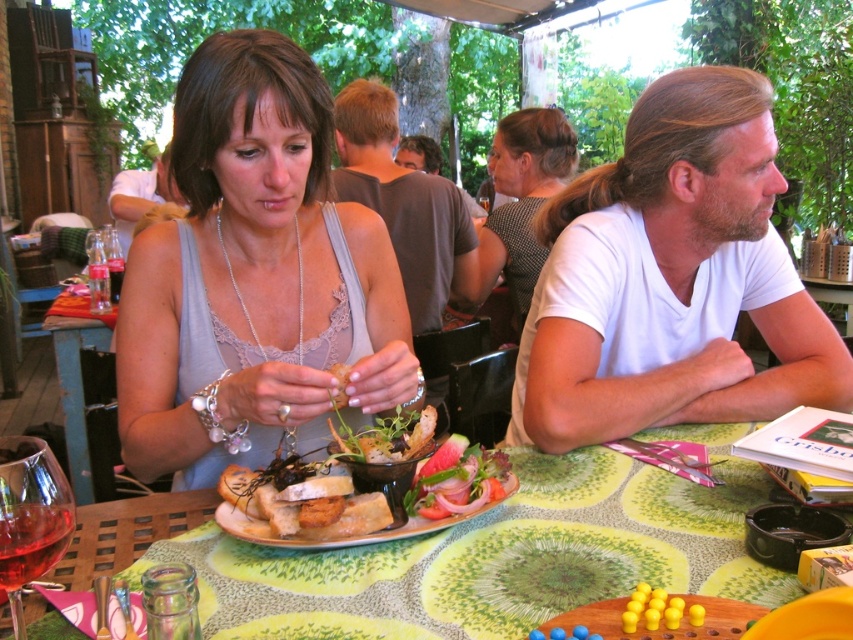
You are a photographer trying to capture a closeup of the transparent glass wine at lower left without the white cotton shirt at upper right appearing in the shot. Can you adjust your position to do this?

The white cotton shirt at upper right is further to the viewer than transparent glass wine at lower left, so moving your camera position slightly forward or to the side might allow you to frame the shot so the transparent glass wine at lower left is visible without the white cotton shirt at upper right blocking it.

In the scene shown: You are a server at the restaurant and need to determine if the white cotton shirt at upper right can be folded and placed into the transparent glass wine at lower left. Based on their sizes, is this possible?

The white cotton shirt at upper right has a larger size compared to the transparent glass wine at lower left, so it cannot be folded and placed inside.

You are a photographer standing at the camera position. You want to take a closeup shot of the gray cotton shirt at center. Considering the distance between you and the shirt, is it possible to capture the shirt clearly without moving closer?

The gray cotton shirt at center is 7.04 feet away from the camera. Since this distance is manageable with a standard zoom lens, you can capture the shirt clearly without moving closer.